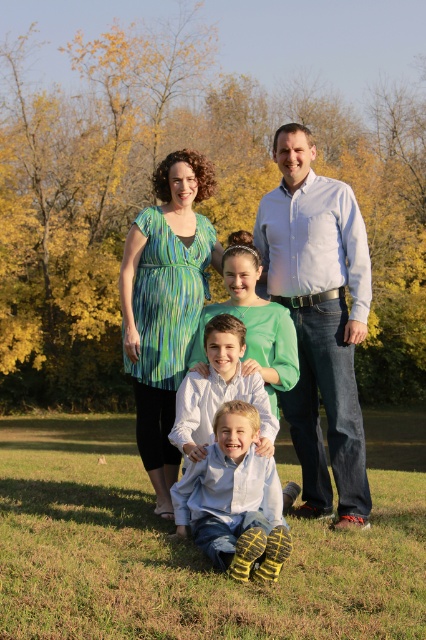
Question: Can you confirm if green striped dress at upper left is positioned above white shirt at center?

Choices:
 (A) yes
 (B) no

Answer: (A)

Question: Can you confirm if green grass at lower center is positioned to the left of yellow rubber boots at lower center?

Choices:
 (A) no
 (B) yes

Answer: (B)

Question: Which of these objects is positioned closest to the white shirt at center?

Choices:
 (A) green striped dress at upper left
 (B) green grass at lower center
 (C) yellow rubber boots at lower center

Answer: (C)

Question: Which point is farther from the camera taking this photo?

Choices:
 (A) (166, 323)
 (B) (282, 628)
 (C) (173, 506)
 (D) (336, 257)

Answer: (D)

Question: Can you confirm if matte green dress at center is positioned below white shirt at center?

Choices:
 (A) yes
 (B) no

Answer: (B)

Question: Which object is farther from the camera taking this photo?

Choices:
 (A) white shirt at upper center
 (B) white shirt at center
 (C) yellow rubber boots at lower center
 (D) matte green dress at center

Answer: (A)